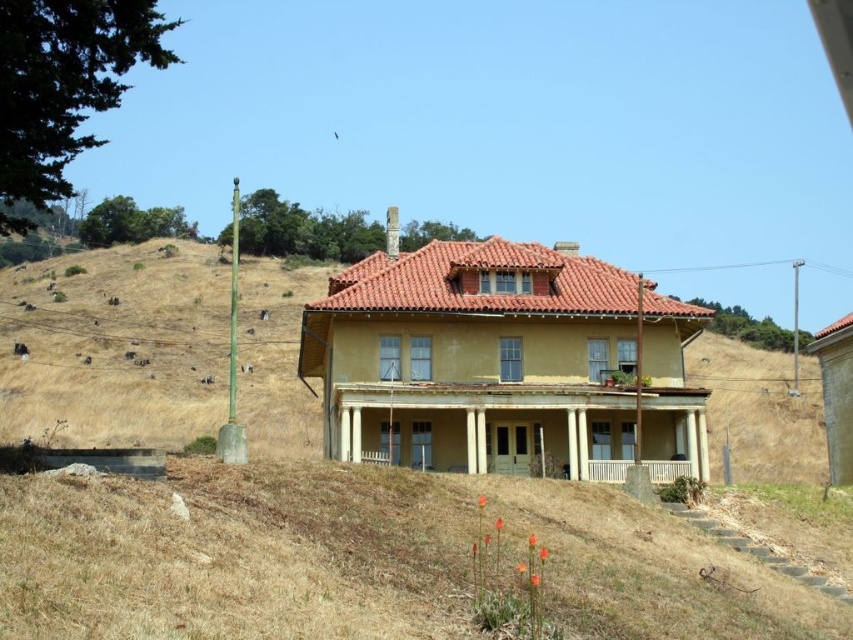
Between dry grass at center and yellow painted wood porch at center, which one appears on the left side from the viewer's perspective?

Positioned to the left is dry grass at center.

I want to click on dry grass at center, so click(x=363, y=560).

Who is taller, dry grass at center or dry grass at left?

With more height is dry grass at left.

From the picture: Who is more forward, [138,531] or [36,317]?

Positioned in front is point [138,531].

The image size is (853, 640). In order to click on dry grass at center in this screenshot , I will do `click(363, 560)`.

This screenshot has height=640, width=853. Describe the element at coordinates (117, 348) in the screenshot. I see `dry grass at left` at that location.

Where is `dry grass at left`? dry grass at left is located at coordinates (117, 348).